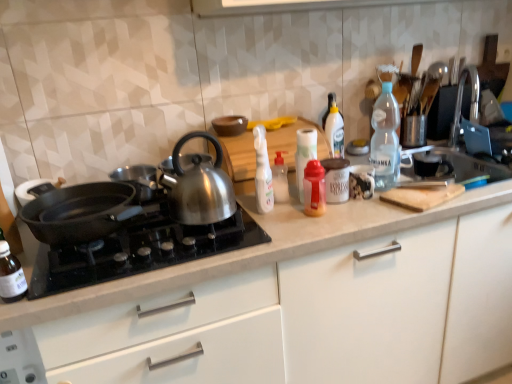
Question: Is transparent plastic bottle at lower left, arranged as the 1th bottle when viewed from the left, in front of shiny metallic kettle at center?

Choices:
 (A) yes
 (B) no

Answer: (A)

Question: From the image's perspective, would you say transparent plastic bottle at lower left, arranged as the 1th bottle when viewed from the left, is shown under shiny metallic kettle at center?

Choices:
 (A) yes
 (B) no

Answer: (A)

Question: Can you confirm if transparent plastic bottle at lower left, the sixth bottle when ordered from right to left, is taller than shiny metallic kettle at center?

Choices:
 (A) yes
 (B) no

Answer: (B)

Question: Is transparent plastic bottle at lower left, the sixth bottle when ordered from right to left, positioned with its back to shiny metallic kettle at center?

Choices:
 (A) no
 (B) yes

Answer: (A)

Question: Is transparent plastic bottle at lower left, arranged as the 1th bottle when viewed from the left, smaller than shiny metallic kettle at center?

Choices:
 (A) yes
 (B) no

Answer: (A)

Question: Is shiny metallic kettle at center in front of or behind black non-stick pan at left in the image?

Choices:
 (A) front
 (B) behind

Answer: (B)

Question: From their relative heights in the image, would you say shiny metallic kettle at center is taller or shorter than black non-stick pan at left?

Choices:
 (A) short
 (B) tall

Answer: (B)

Question: Based on their sizes in the image, would you say shiny metallic kettle at center is bigger or smaller than black non-stick pan at left?

Choices:
 (A) big
 (B) small

Answer: (B)

Question: From a real-world perspective, is shiny metallic kettle at center above or below black non-stick pan at left?

Choices:
 (A) above
 (B) below

Answer: (A)

Question: Is black non-stick pan at left inside or outside of white matte jar at center?

Choices:
 (A) inside
 (B) outside

Answer: (B)

Question: From the image's perspective, is black non-stick pan at left located above or below white matte jar at center?

Choices:
 (A) below
 (B) above

Answer: (A)

Question: From a real-world perspective, is black non-stick pan at left physically located above or below white matte jar at center?

Choices:
 (A) below
 (B) above

Answer: (B)

Question: Is black non-stick pan at left to the left or to the right of white matte jar at center in the image?

Choices:
 (A) left
 (B) right

Answer: (A)

Question: Is point (266, 185) positioned closer to the camera than point (318, 205)?

Choices:
 (A) closer
 (B) farther

Answer: (B)

Question: In terms of height, does white plastic spray bottle at center, the fifth bottle when ordered from right to left, look taller or shorter compared to translucent plastic bottle at center, the second bottle in the right-to-left sequence?

Choices:
 (A) short
 (B) tall

Answer: (B)